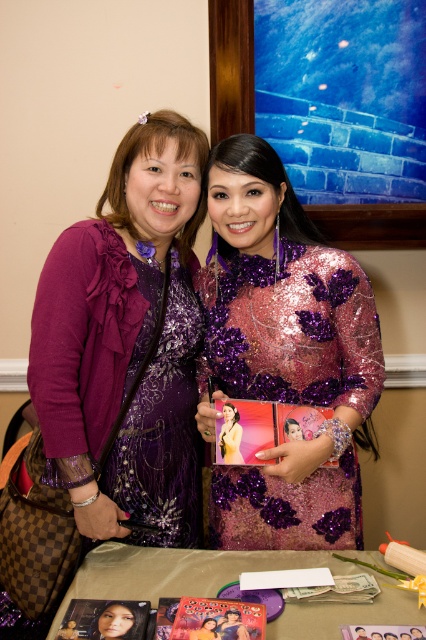
Who is positioned more to the left, purple sequined dress at center or metallic gold table at lower center?

purple sequined dress at center

Is purple sequined dress at center taller than metallic gold table at lower center?

Correct, purple sequined dress at center is much taller as metallic gold table at lower center.

Where is `purple sequined dress at center`? Image resolution: width=426 pixels, height=640 pixels. purple sequined dress at center is located at coordinates (127, 336).

Which is more to the right, sequined purple dress at center or metallic gold photo frame at center?

sequined purple dress at center

Which is behind, point (327, 388) or point (204, 637)?

The point (327, 388) is behind.

Locate an element on the screen. The image size is (426, 640). sequined purple dress at center is located at coordinates (285, 355).

Who is taller, purple sequined dress at center or sequined purple dress at center?

Standing taller between the two is purple sequined dress at center.

Looking at this image, who is positioned more to the right, purple sequined dress at center or sequined purple dress at center?

Positioned to the right is sequined purple dress at center.

Who is more forward, (199, 445) or (265, 202)?

Positioned in front is point (265, 202).

At what (x,y) coordinates should I click in order to perform the action: click on purple sequined dress at center. Please return your answer as a coordinate pair (x, y). Image resolution: width=426 pixels, height=640 pixels. Looking at the image, I should click on (127, 336).